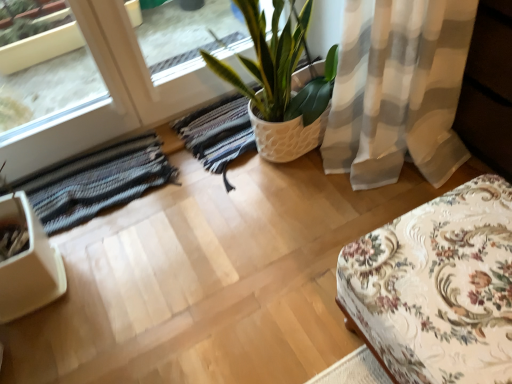
Question: Is floral fabric ottoman at lower right at the back of white textured pot at center?

Choices:
 (A) yes
 (B) no

Answer: (B)

Question: Can you confirm if white textured pot at center is taller than floral fabric ottoman at lower right?

Choices:
 (A) yes
 (B) no

Answer: (A)

Question: Is white textured pot at center oriented towards floral fabric ottoman at lower right?

Choices:
 (A) no
 (B) yes

Answer: (B)

Question: Is white textured pot at center further to the viewer compared to floral fabric ottoman at lower right?

Choices:
 (A) no
 (B) yes

Answer: (B)

Question: Is white textured pot at center far away from floral fabric ottoman at lower right?

Choices:
 (A) yes
 (B) no

Answer: (B)

Question: From the image's perspective, is floral fabric ottoman at lower right located above or below striped woolen rug at lower left?

Choices:
 (A) above
 (B) below

Answer: (B)

Question: Is floral fabric ottoman at lower right bigger or smaller than striped woolen rug at lower left?

Choices:
 (A) small
 (B) big

Answer: (B)

Question: Considering the positions of floral fabric ottoman at lower right and striped woolen rug at lower left in the image, is floral fabric ottoman at lower right taller or shorter than striped woolen rug at lower left?

Choices:
 (A) tall
 (B) short

Answer: (A)

Question: Relative to striped woolen rug at lower left, is floral fabric ottoman at lower right in front or behind?

Choices:
 (A) behind
 (B) front

Answer: (B)

Question: Does point (216, 59) appear closer or farther from the camera than point (472, 331)?

Choices:
 (A) closer
 (B) farther

Answer: (B)

Question: Is white textured pot at center to the left or to the right of floral fabric ottoman at lower right in the image?

Choices:
 (A) left
 (B) right

Answer: (A)

Question: In terms of height, does white textured pot at center look taller or shorter compared to floral fabric ottoman at lower right?

Choices:
 (A) short
 (B) tall

Answer: (B)

Question: From a real-world perspective, relative to floral fabric ottoman at lower right, is white textured pot at center vertically above or below?

Choices:
 (A) above
 (B) below

Answer: (A)

Question: In terms of height, does striped woolen rug at lower left look taller or shorter compared to floral fabric ottoman at lower right?

Choices:
 (A) tall
 (B) short

Answer: (B)

Question: Is striped woolen rug at lower left spatially inside floral fabric ottoman at lower right, or outside of it?

Choices:
 (A) outside
 (B) inside

Answer: (A)